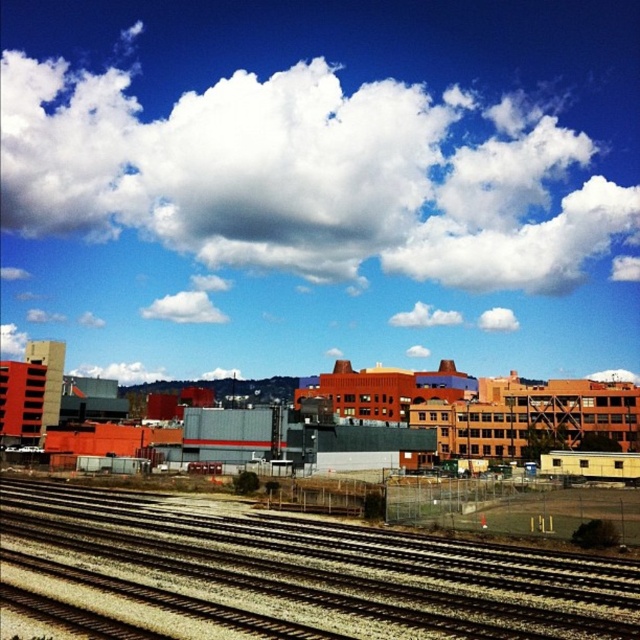
Identify the location of white fluffy cloud at upper center. This screenshot has height=640, width=640. (307, 176).

Between white fluffy cloud at upper center and brown gravel tracks at lower center, which one is positioned higher?

white fluffy cloud at upper center is higher up.

Which is behind, point (516, 250) or point (58, 522)?

Point (516, 250)

I want to click on white fluffy cloud at upper center, so click(x=307, y=176).